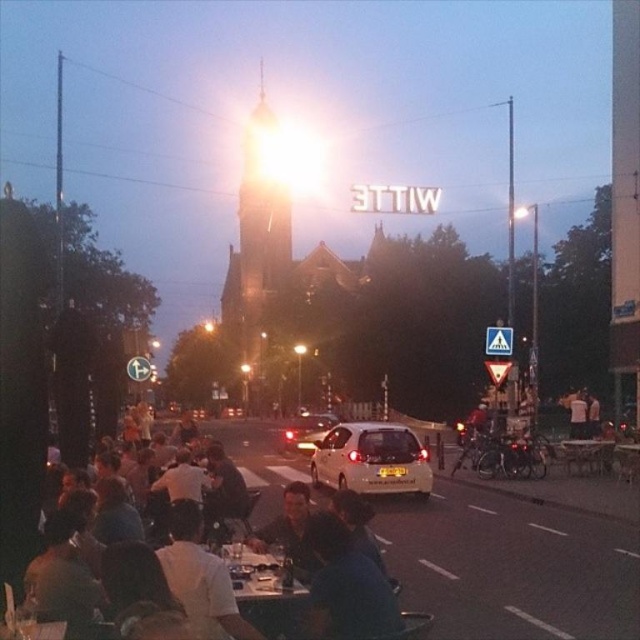
Question: Which object appears closest to the camera in this image?

Choices:
 (A) white glossy table at center
 (B) dark blue fabric at lower left
 (C) white matte hatchback at center

Answer: (A)

Question: Does dark blue fabric at lower left lie behind white glossy table at center?

Choices:
 (A) no
 (B) yes

Answer: (B)

Question: Is dark blue fabric at lower left further to camera compared to white matte hatchback at center?

Choices:
 (A) no
 (B) yes

Answer: (A)

Question: Is white matte hatchback at center to the right of wooden table at center from the viewer's perspective?

Choices:
 (A) no
 (B) yes

Answer: (A)

Question: Which of the following is the closest to the observer?

Choices:
 (A) white matte hatchback at center
 (B) white glossy table at center
 (C) white matte car at center
 (D) wooden table at center

Answer: (B)

Question: Among these objects, which one is farthest from the camera?

Choices:
 (A) white matte hatchback at center
 (B) white matte car at center

Answer: (B)